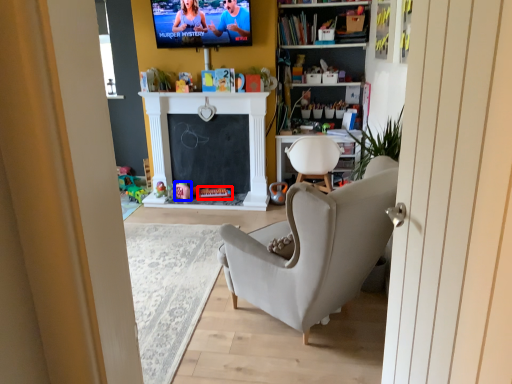
Question: Which of the following is the closest to the observer, toy (highlighted by a red box) or toy (highlighted by a blue box)?

Choices:
 (A) toy
 (B) toy

Answer: (B)